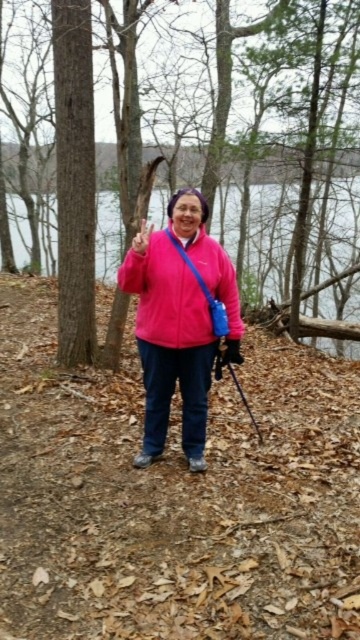
You are a hiker who wants to cross the transparent water at center. You have a map showing a point at coordinates (x=259, y=234). What is located at that point?

The point at coordinates (x=259, y=234) corresponds to transparent water at center.

You are a hiker who wants to cross the transparent water at center using the matte black glove at center as a makeshift bridge. Based on their sizes, will the glove be wide enough to support your weight?

The transparent water at center is wider than the matte black glove at center, so the glove would not be wide enough to support your weight as a makeshift bridge.

You are a photographer trying to capture a closeup of the pink matte jacket at center and the black plastic ski pole at center. If you want to focus on both objects equally, which one should you move closer to the camera?

Since the pink matte jacket at center is wider than the black plastic ski pole at center, you should move the ski pole closer to the camera to ensure both objects appear similarly sized in the photo.